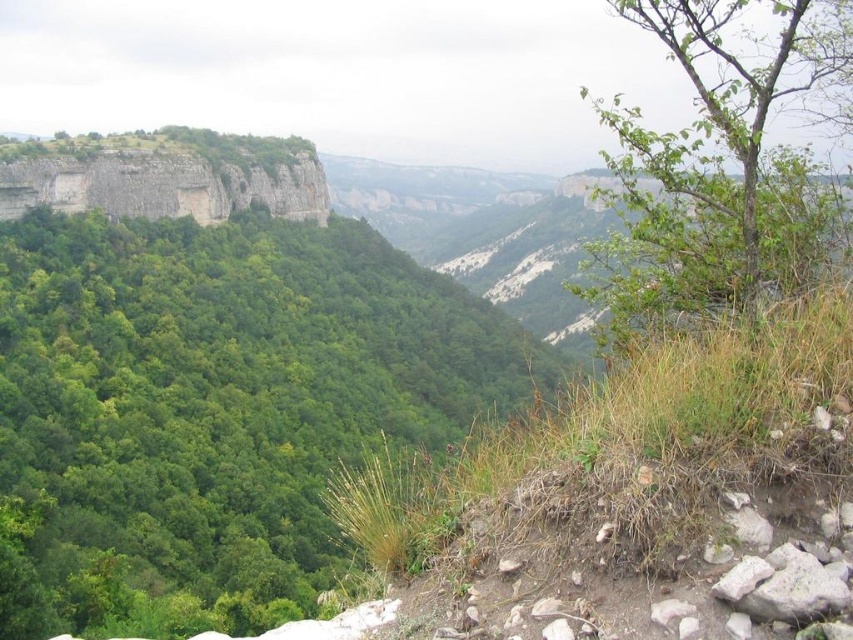
Question: Is green leafy tree at center thinner than green leafy tree at upper right?

Choices:
 (A) yes
 (B) no

Answer: (A)

Question: Among these points, which one is farthest from the camera?

Choices:
 (A) (28, 330)
 (B) (698, 13)

Answer: (A)

Question: Can you confirm if green leafy tree at center is smaller than green leafy tree at upper right?

Choices:
 (A) yes
 (B) no

Answer: (A)

Question: Can you confirm if green leafy tree at center is wider than green leafy tree at upper right?

Choices:
 (A) no
 (B) yes

Answer: (A)

Question: Which point is closer to the camera taking this photo?

Choices:
 (A) (230, 532)
 (B) (706, 4)

Answer: (B)